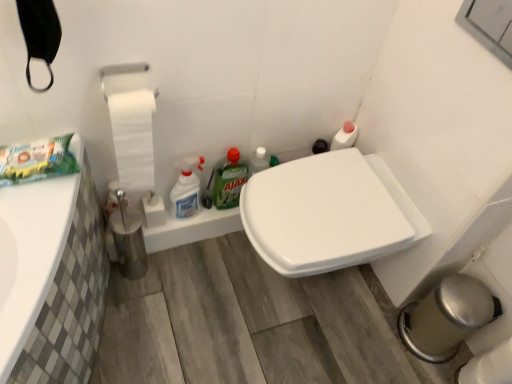
What are the coordinates of `vacant area on top of white glossy toilet seat at center (from a real-world perspective)` in the screenshot? It's located at (324, 203).